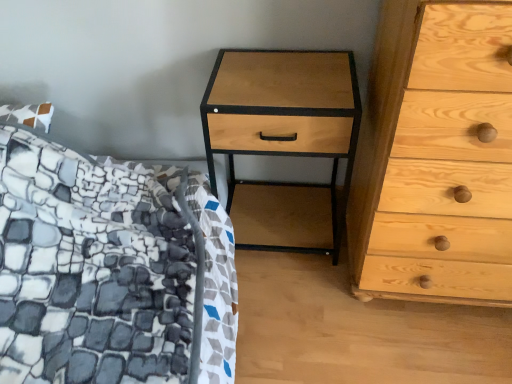
Question: Can you confirm if natural wood nightstand at center is shorter than natural wood chest of drawers at right?

Choices:
 (A) yes
 (B) no

Answer: (A)

Question: Is natural wood nightstand at center beside natural wood chest of drawers at right?

Choices:
 (A) yes
 (B) no

Answer: (B)

Question: Would you say natural wood nightstand at center is a long distance from natural wood chest of drawers at right?

Choices:
 (A) yes
 (B) no

Answer: (B)

Question: Is the position of natural wood nightstand at center less distant than that of natural wood chest of drawers at right?

Choices:
 (A) no
 (B) yes

Answer: (A)

Question: Considering the relative sizes of natural wood nightstand at center and natural wood chest of drawers at right in the image provided, is natural wood nightstand at center thinner than natural wood chest of drawers at right?

Choices:
 (A) yes
 (B) no

Answer: (A)

Question: Does natural wood nightstand at center come behind natural wood chest of drawers at right?

Choices:
 (A) no
 (B) yes

Answer: (B)

Question: From a real-world perspective, is natural wood chest of drawers at right beneath natural wood nightstand at center?

Choices:
 (A) no
 (B) yes

Answer: (A)

Question: Is natural wood nightstand at center located within natural wood chest of drawers at right?

Choices:
 (A) yes
 (B) no

Answer: (B)

Question: Can you confirm if natural wood chest of drawers at right is smaller than natural wood nightstand at center?

Choices:
 (A) no
 (B) yes

Answer: (A)

Question: Could you tell me if natural wood chest of drawers at right is facing natural wood nightstand at center?

Choices:
 (A) no
 (B) yes

Answer: (A)

Question: From the image's perspective, is natural wood chest of drawers at right above natural wood nightstand at center?

Choices:
 (A) no
 (B) yes

Answer: (B)

Question: Is natural wood chest of drawers at right not near natural wood nightstand at center?

Choices:
 (A) yes
 (B) no

Answer: (B)

Question: Is natural wood chest of drawers at right in front of or behind natural wood nightstand at center in the image?

Choices:
 (A) behind
 (B) front

Answer: (B)